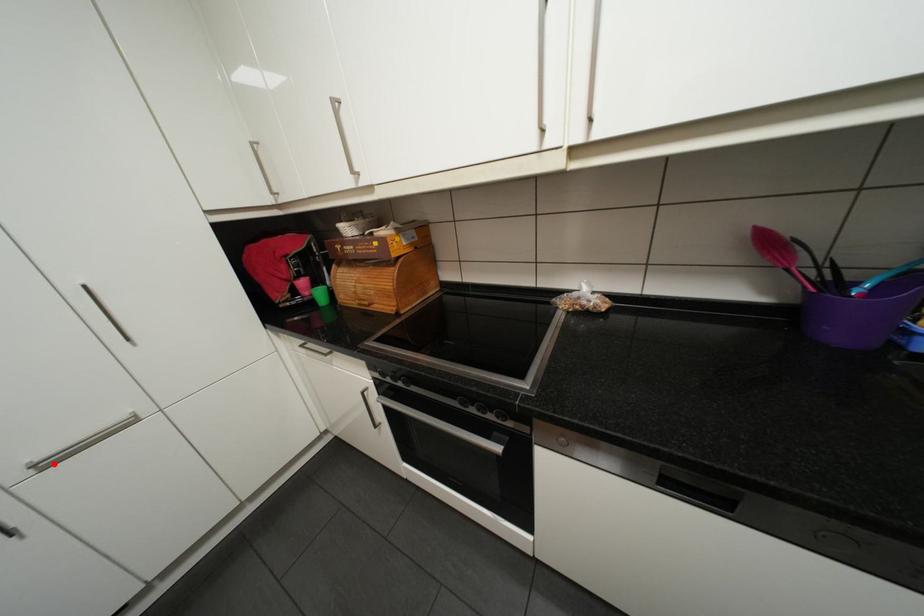
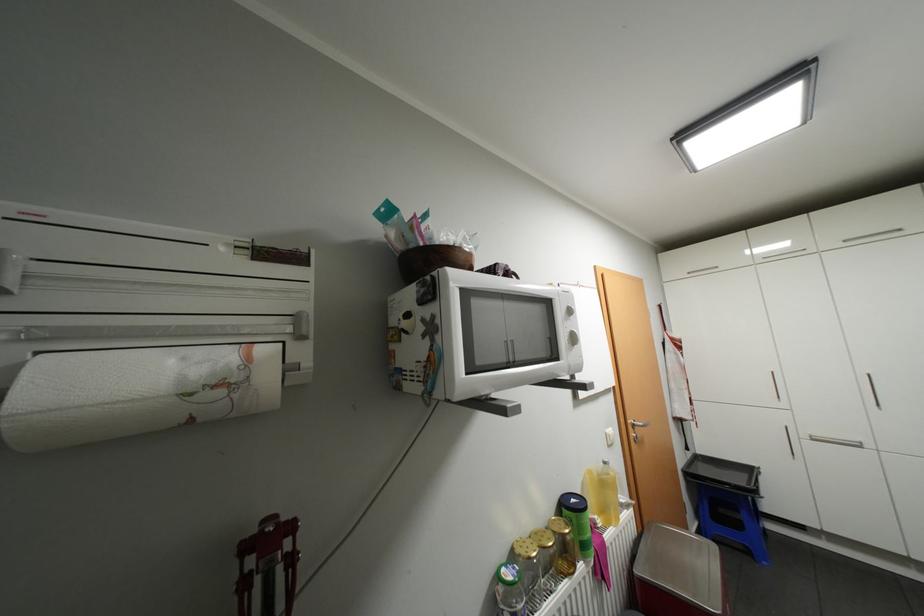
The point at the highlighted location is marked in the first image. Where is the corresponding point in the second image?

(821, 438)